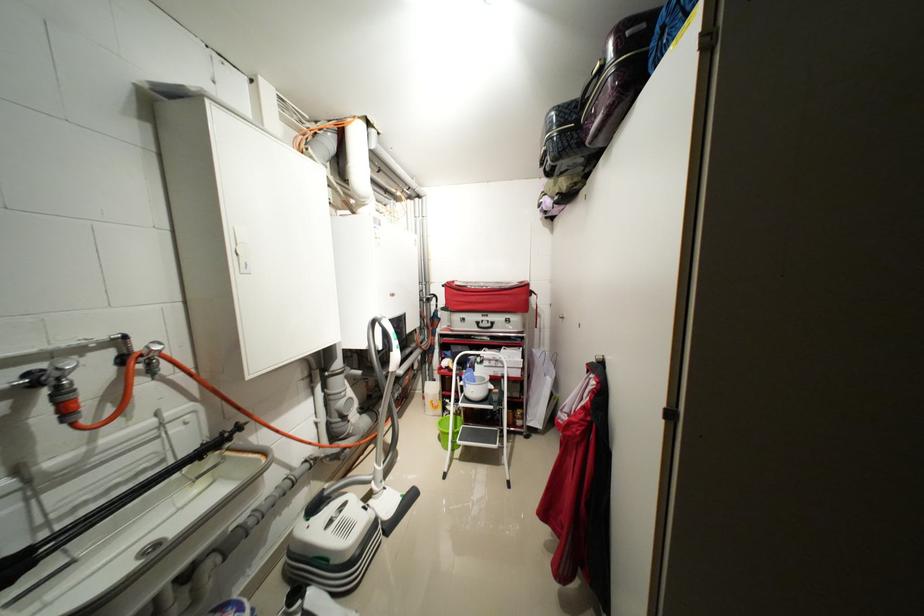
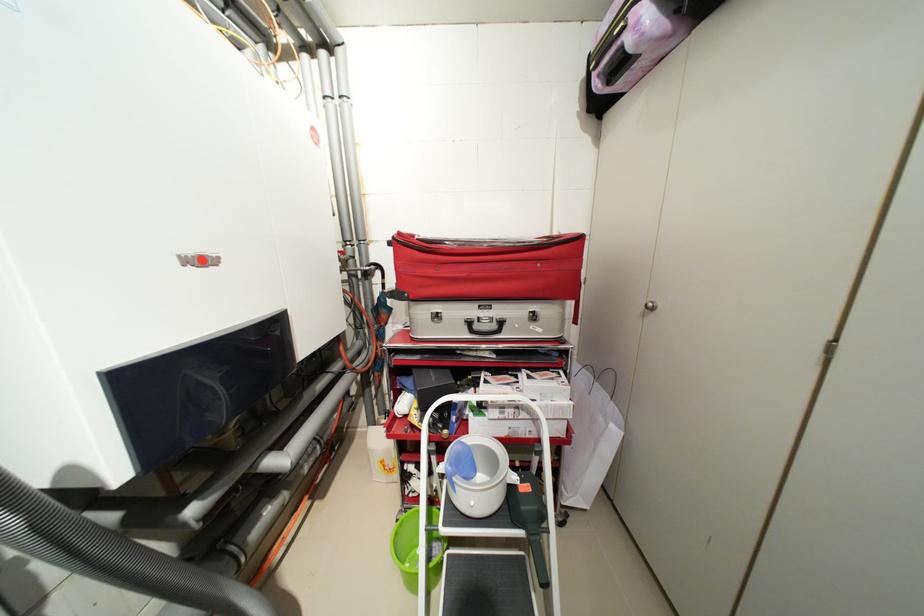
In the second image, find the point that corresponds to (455,284) in the first image.

(407, 235)